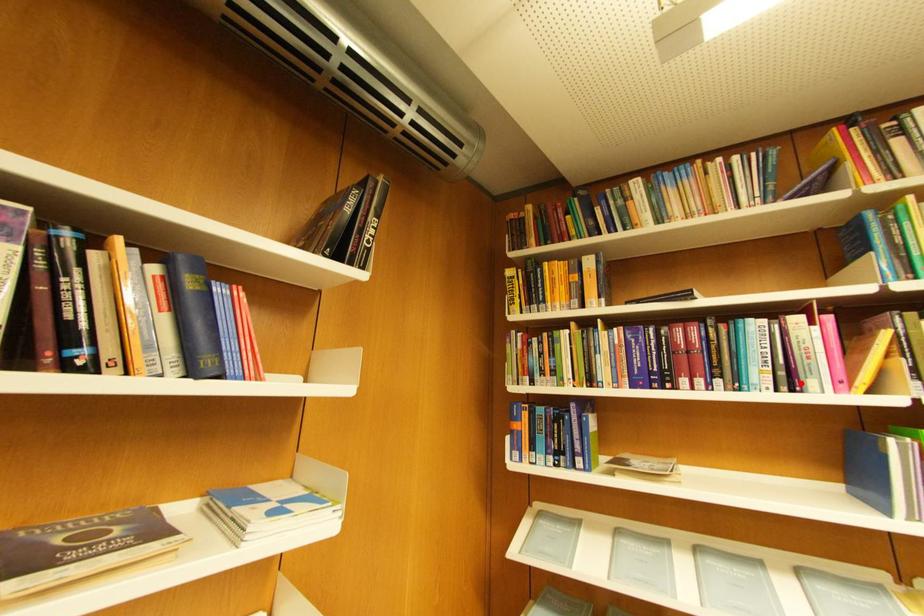
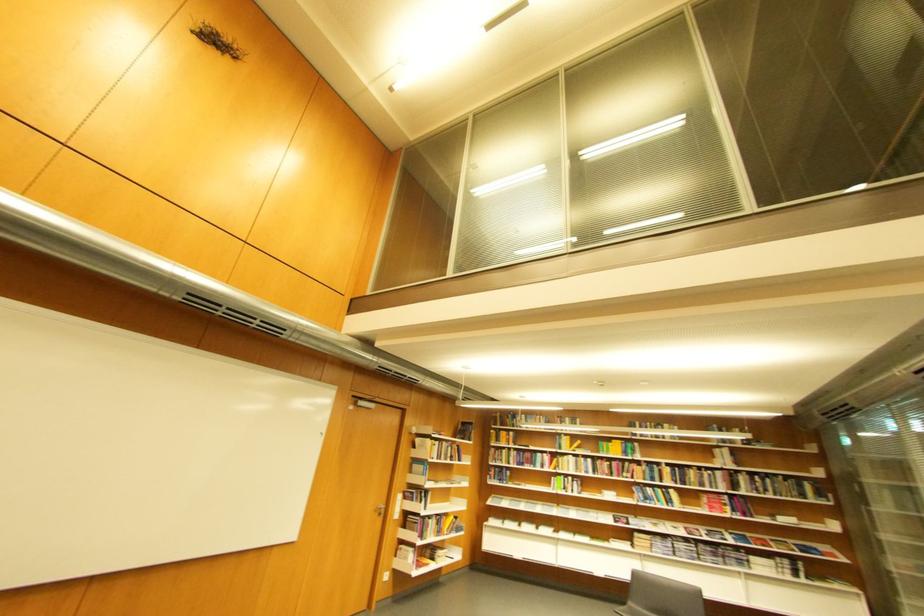
Question: A red point is marked in image1. In image2, is the corresponding 3D point closer to the camera or farther? Reply with the corresponding letter.

Choices:
 (A) The corresponding 3D point is closer.
 (B) The corresponding 3D point is farther.

Answer: (B)